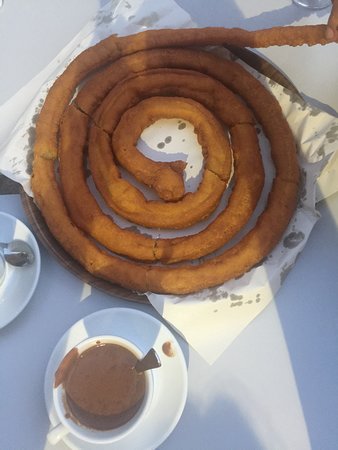
In order to click on plate in this screenshot , I will do `click(167, 408)`.